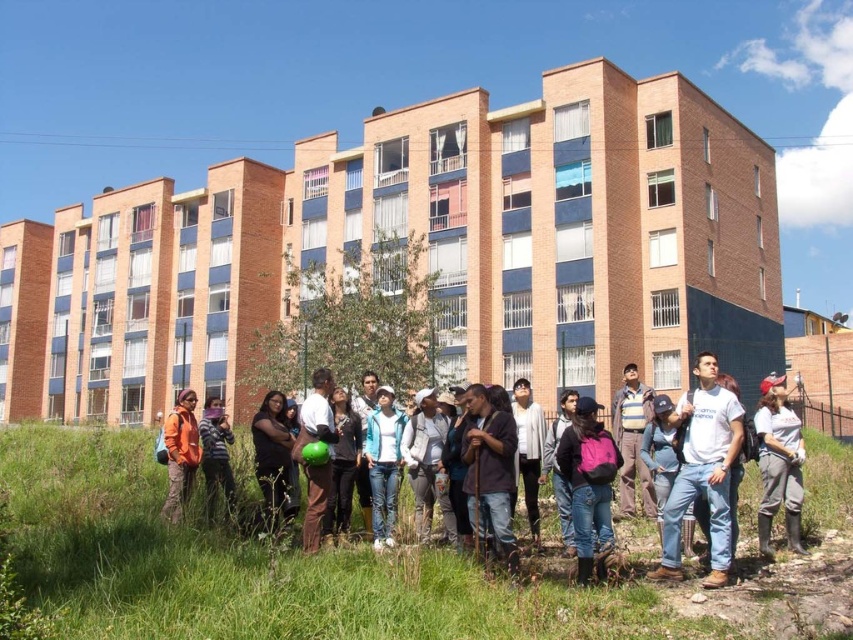
You are standing at the origin point of the image, which is the bottom left corner. You want to locate the denim jacket at center. Which direction should you move to reach it?

The denim jacket at center is located at point 0.720 in the x direction and 0.842 in the y direction. Since the origin is at the bottom left corner, you should move to the right and upwards to reach the denim jacket at center.